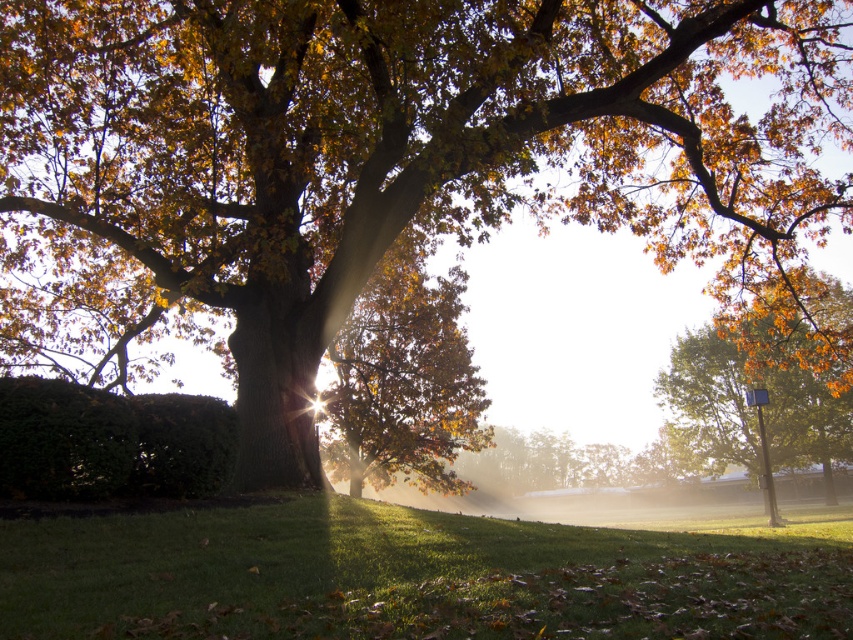
Question: Which of the following is the closest to the observer?

Choices:
 (A) (473, 406)
 (B) (679, 385)
 (C) (231, 616)
 (D) (4, 468)

Answer: (C)

Question: In this image, where is golden brown leaves at center located relative to green leafy hedge at lower left?

Choices:
 (A) right
 (B) left

Answer: (A)

Question: Which point is closer to the camera taking this photo?

Choices:
 (A) (776, 328)
 (B) (816, 636)
 (C) (444, 298)
 (D) (216, 467)

Answer: (B)

Question: Is golden textured leaves at center in front of golden brown leaves at center?

Choices:
 (A) no
 (B) yes

Answer: (A)

Question: Which point is closer to the camera taking this photo?

Choices:
 (A) (251, 509)
 (B) (822, 449)
 (C) (113, 445)
 (D) (381, 337)

Answer: (C)

Question: Can you confirm if green grassy at lower center is positioned below golden brown leaves at center?

Choices:
 (A) no
 (B) yes

Answer: (A)